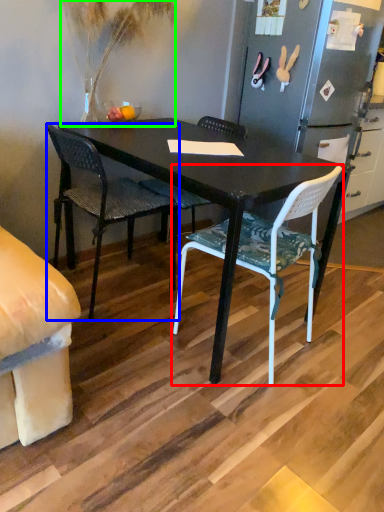
Question: Considering the real-world distances, which object is closest to chair (highlighted by a red box)? chair (highlighted by a blue box) or houseplant (highlighted by a green box).

Choices:
 (A) chair
 (B) houseplant

Answer: (A)